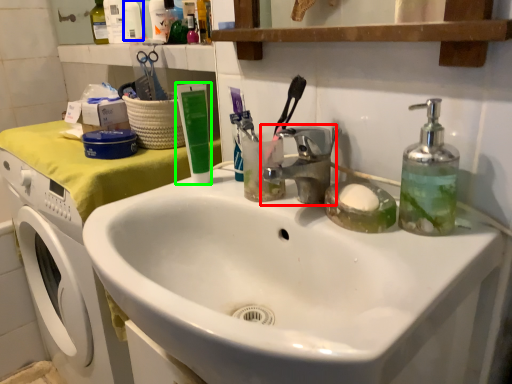
Question: Estimate the real-world distances between objects in this image. Which object is closer to tap (highlighted by a red box), toiletry (highlighted by a blue box) or toothpaste (highlighted by a green box)?

Choices:
 (A) toiletry
 (B) toothpaste

Answer: (B)